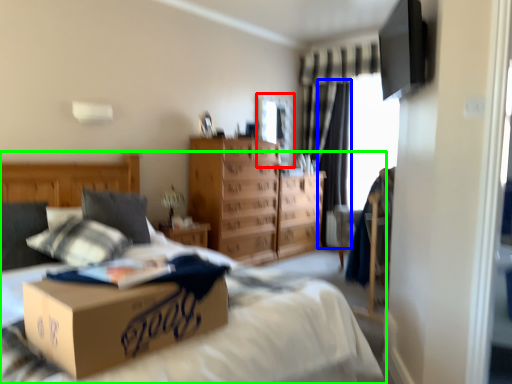
Question: Considering the real-world distances, which object is farthest from window screen (highlighted by a red box)? curtain (highlighted by a blue box) or bed (highlighted by a green box)?

Choices:
 (A) curtain
 (B) bed

Answer: (B)